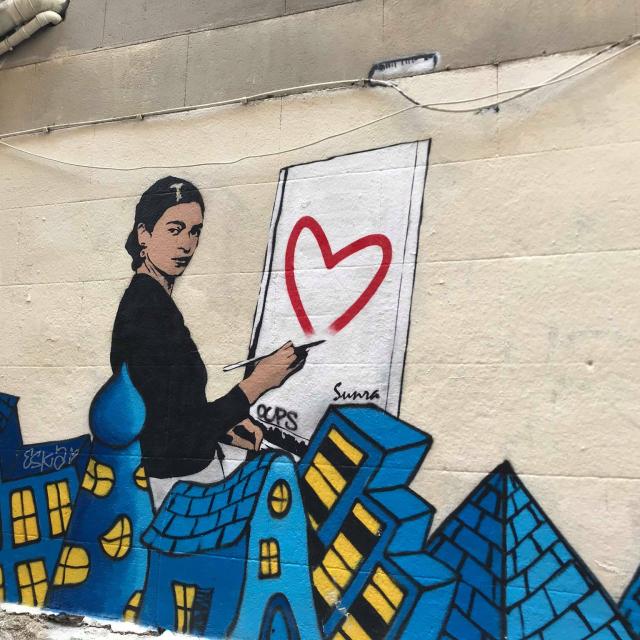
Where is `wall`? The width and height of the screenshot is (640, 640). wall is located at coordinates (358, 187).